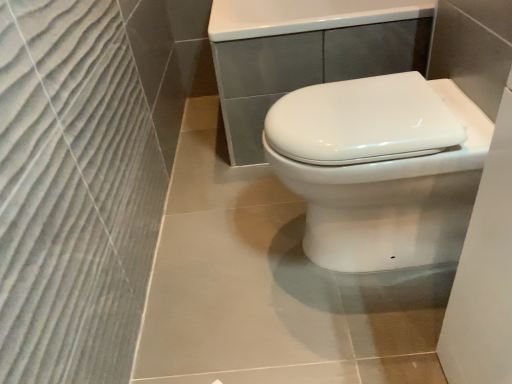
Question: Considering the relative sizes of white glossy toilet at center and white glossy porcelain at center in the image provided, is white glossy toilet at center shorter than white glossy porcelain at center?

Choices:
 (A) no
 (B) yes

Answer: (B)

Question: Is the depth of white glossy toilet at center greater than that of white glossy porcelain at center?

Choices:
 (A) yes
 (B) no

Answer: (B)

Question: Would you say white glossy toilet at center is a long distance from white glossy porcelain at center?

Choices:
 (A) no
 (B) yes

Answer: (A)

Question: From the image's perspective, is white glossy toilet at center under white glossy porcelain at center?

Choices:
 (A) no
 (B) yes

Answer: (B)

Question: Is white glossy porcelain at center at the back of white glossy toilet at center?

Choices:
 (A) yes
 (B) no

Answer: (B)

Question: Does white glossy toilet at center have a greater width compared to white glossy porcelain at center?

Choices:
 (A) yes
 (B) no

Answer: (B)

Question: Can you confirm if white glossy porcelain at center is thinner than white glossy toilet at center?

Choices:
 (A) yes
 (B) no

Answer: (B)

Question: From the image's perspective, is white glossy porcelain at center below white glossy toilet at center?

Choices:
 (A) no
 (B) yes

Answer: (A)

Question: From the image's perspective, is white glossy porcelain at center located above white glossy toilet at center?

Choices:
 (A) no
 (B) yes

Answer: (B)

Question: Is white glossy porcelain at center further to the viewer compared to white glossy toilet at center?

Choices:
 (A) yes
 (B) no

Answer: (A)

Question: Is white glossy porcelain at center positioned in front of white glossy toilet at center?

Choices:
 (A) yes
 (B) no

Answer: (B)

Question: Does white glossy porcelain at center have a greater height compared to white glossy toilet at center?

Choices:
 (A) yes
 (B) no

Answer: (A)

Question: From their relative heights in the image, would you say white glossy porcelain at center is taller or shorter than white glossy toilet at center?

Choices:
 (A) tall
 (B) short

Answer: (A)